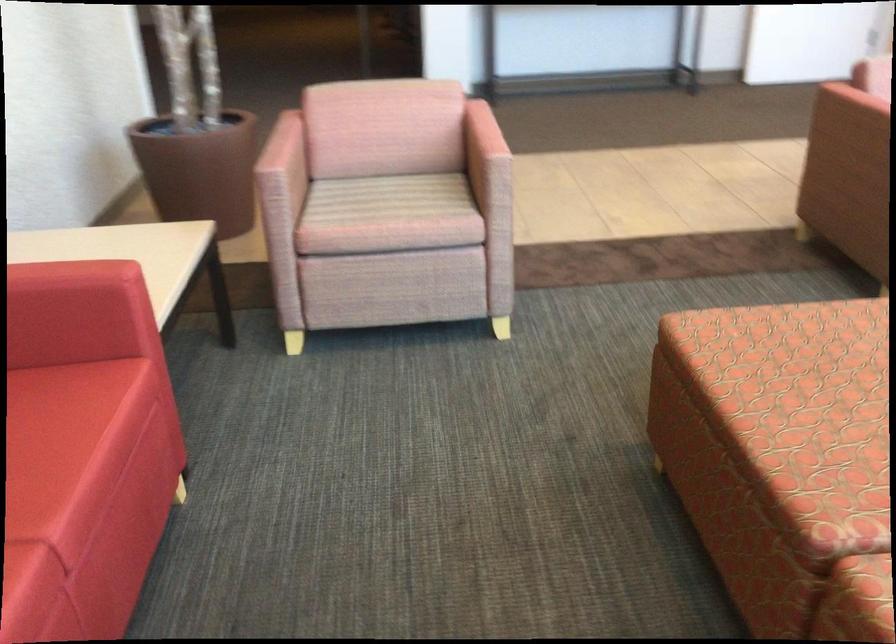
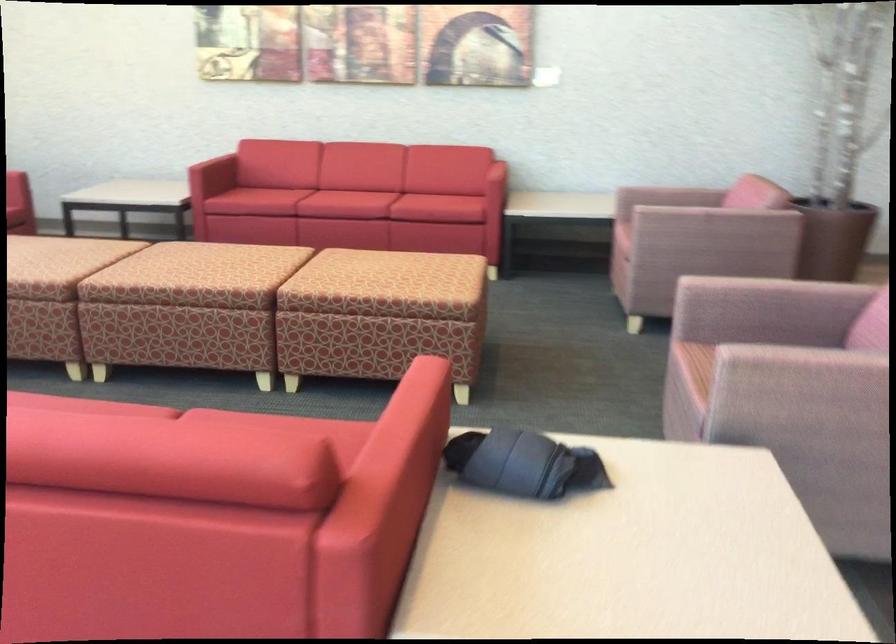
In the second image, find the point that corresponds to point 373,223 in the first image.

(624, 218)